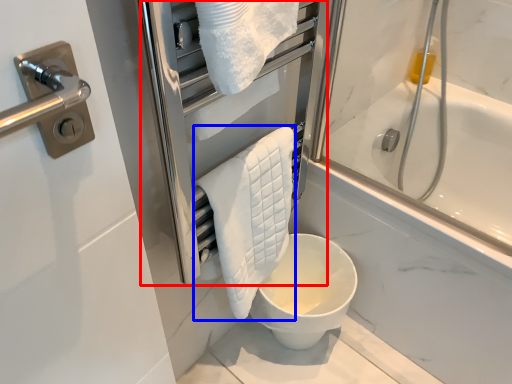
Question: Among these objects, which one is farthest to the camera, screen door (highlighted by a red box) or bath towel (highlighted by a blue box)?

Choices:
 (A) screen door
 (B) bath towel

Answer: (B)